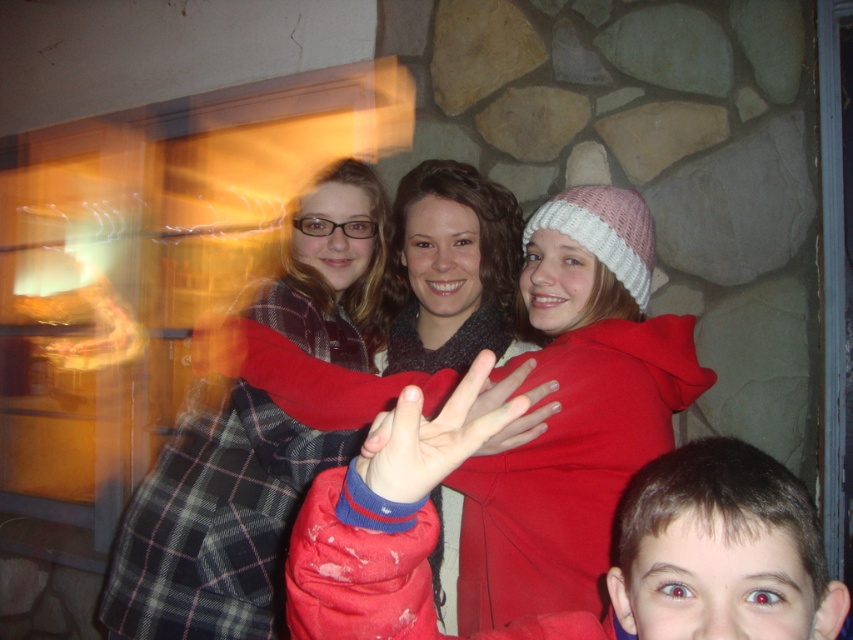
Can you confirm if matte red jacket at lower right is wider than knitted woolen hat at center?

No.

Which is above, matte red jacket at lower right or knitted woolen hat at center?

Positioned higher is knitted woolen hat at center.

Which is in front, point (328, 552) or point (537, 586)?

Positioned in front is point (328, 552).

You are a GUI agent. You are given a task and a screenshot of the screen. Output one action in this format:
    pyautogui.click(x=<x>, y=<y>)
    Task: Click on the matte red jacket at lower right
    The height and width of the screenshot is (640, 853).
    Given the screenshot: What is the action you would take?
    (x=709, y=556)